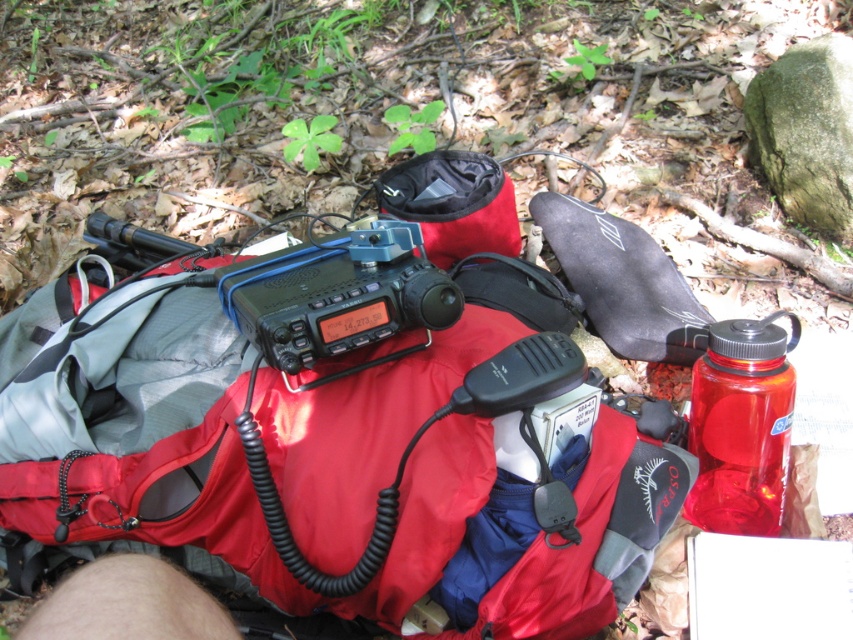
You are standing at the point marked as point (498, 476) in the forest scene. You want to place a 75 centimeter long stick on the ground so that one end touches your current position. Where should the other end be placed to ensure the stick is fully visible without bending?

The other end of the 75 centimeter long stick should be placed exactly 75 centimeters away from point (498, 476) in the direction facing away from the viewer. This ensures the entire stick lies flat on the ground and remains visible without bending.